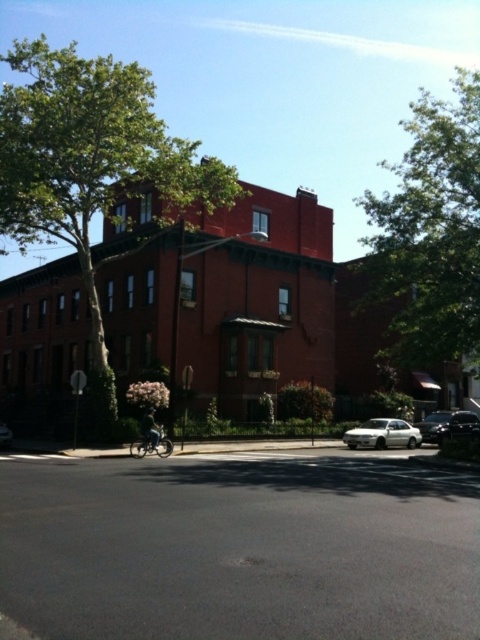
Question: Is green leafy tree at upper right above shiny metallic motorcycle at center?

Choices:
 (A) yes
 (B) no

Answer: (A)

Question: Is green leafy tree at upper right positioned in front of white matte sedan at lower right?

Choices:
 (A) yes
 (B) no

Answer: (A)

Question: From the image, what is the correct spatial relationship of green leafy tree at upper left in relation to green leafy tree at upper right?

Choices:
 (A) above
 (B) below

Answer: (A)

Question: Considering the real-world distances, which object is closest to the green leafy tree at upper left?

Choices:
 (A) white glossy car at lower center
 (B) white matte sedan at lower right

Answer: (A)

Question: Which of these objects is positioned farthest from the white glossy car at lower center?

Choices:
 (A) shiny metallic motorcycle at center
 (B) green leafy tree at upper right
 (C) white matte sedan at lower right
 (D) green leafy tree at upper left

Answer: (B)

Question: Which of the following is the closest to the observer?

Choices:
 (A) shiny silver sedan at lower right
 (B) shiny black sedan at lower right

Answer: (B)